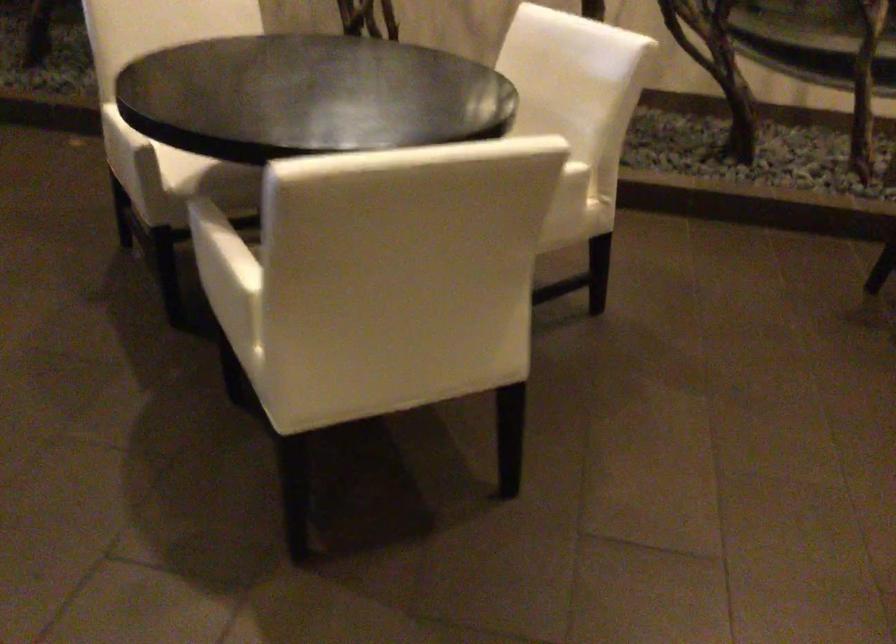
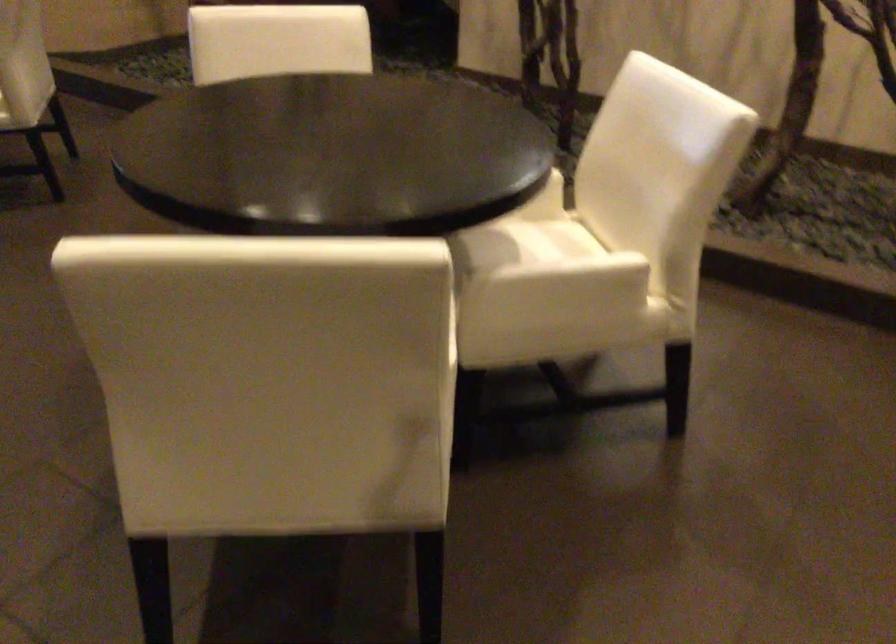
Which direction would the cameraman need to move to produce the second image?

The movement direction of the cameraman is right, forward.